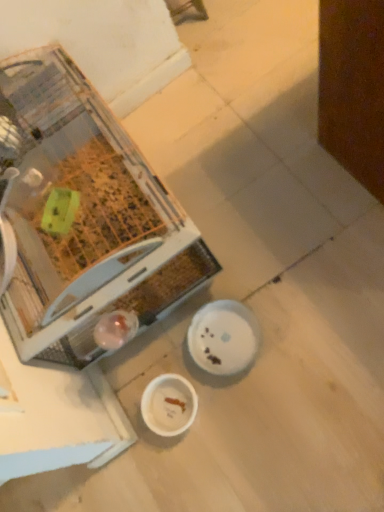
What is the approximate height of clear plastic cage at left?

It is 18.87 inches.

This screenshot has width=384, height=512. I want to click on clear plastic cage at left, so click(x=84, y=219).

What is the approximate width of clear plastic cage at left?

clear plastic cage at left is 48.84 centimeters in width.

This screenshot has height=512, width=384. Describe the element at coordinates (84, 219) in the screenshot. I see `clear plastic cage at left` at that location.

Where is `clear plastic cage at left`? The image size is (384, 512). clear plastic cage at left is located at coordinates (84, 219).